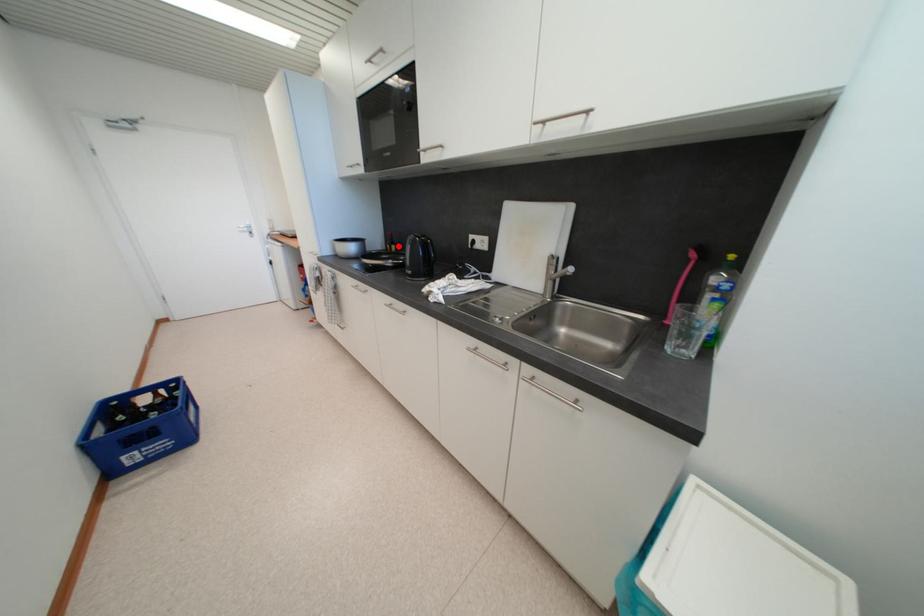
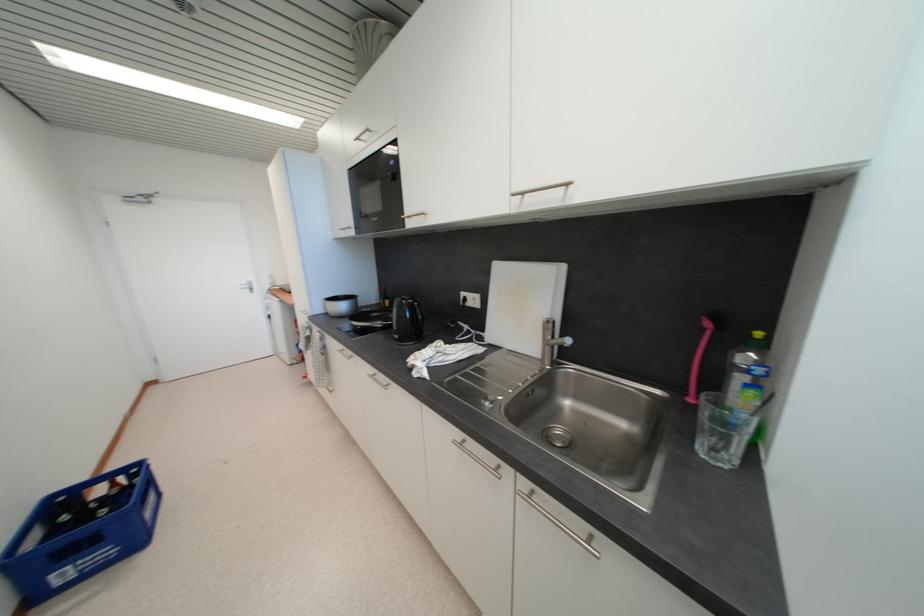
Find the pixel in the second image that matches the highlighted location in the first image.

(392, 301)